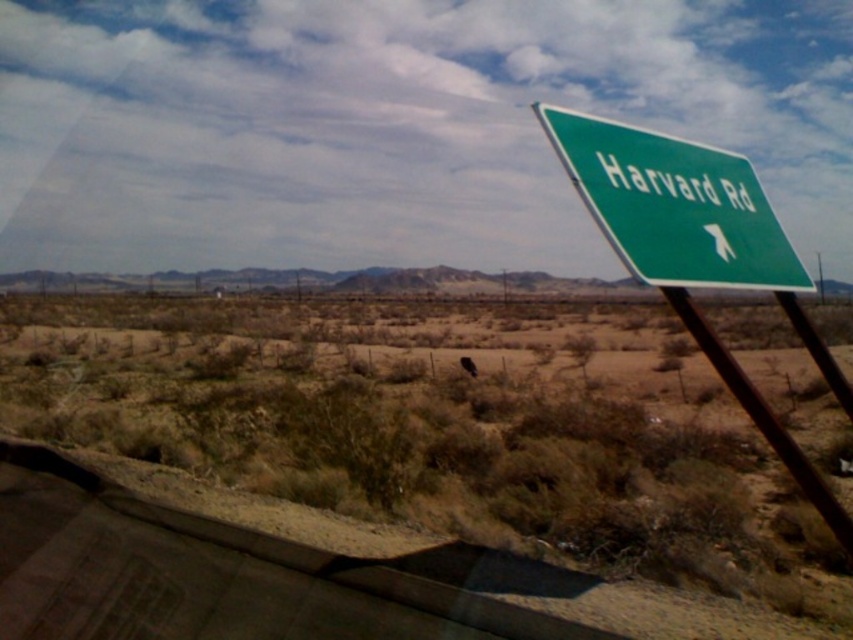
Question: Is green plastic street sign at upper right thinner than green glossy sign at upper right?

Choices:
 (A) yes
 (B) no

Answer: (B)

Question: Is green plastic street sign at upper right smaller than green metallic pole at upper right?

Choices:
 (A) yes
 (B) no

Answer: (B)

Question: Which point appears farthest from the camera in this image?

Choices:
 (A) (648, 156)
 (B) (757, 422)

Answer: (A)

Question: Which point appears closest to the camera in this image?

Choices:
 (A) (701, 225)
 (B) (683, 316)
 (C) (686, 269)

Answer: (B)

Question: Is green glossy sign at upper right wider than green metallic pole at upper right?

Choices:
 (A) yes
 (B) no

Answer: (B)

Question: Which object is positioned closest to the green glossy sign at upper right?

Choices:
 (A) green metallic pole at upper right
 (B) green plastic street sign at upper right

Answer: (A)